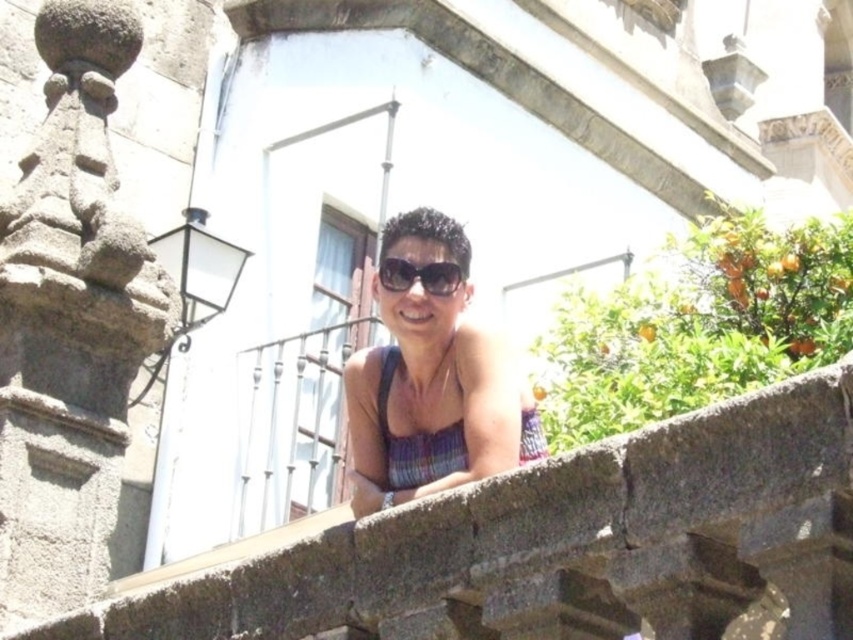
Is rough stone ledge at center thinner than green leafy bush at upper right?

No, rough stone ledge at center is not thinner than green leafy bush at upper right.

Which is above, rough stone ledge at center or green leafy bush at upper right?

green leafy bush at upper right is higher up.

Between point (642, 604) and point (693, 260), which one is positioned behind?

Positioned behind is point (693, 260).

What are the coordinates of `rough stone ledge at center` in the screenshot? It's located at (563, 544).

Does rough stone ledge at center lie in front of matte black tank top at center?

Yes, it is in front of matte black tank top at center.

Is rough stone ledge at center positioned at the back of matte black tank top at center?

No, rough stone ledge at center is in front of matte black tank top at center.

Which is behind, point (648, 502) or point (498, 340)?

Positioned behind is point (498, 340).

At what (x,y) coordinates should I click in order to perform the action: click on rough stone ledge at center. Please return your answer as a coordinate pair (x, y). Looking at the image, I should click on (563, 544).

Based on the photo, between rough stone ledge at center and black plastic sunglasses at center, which one is positioned higher?

black plastic sunglasses at center is higher up.

Which is more to the left, rough stone ledge at center or black plastic sunglasses at center?

rough stone ledge at center

Is point (555, 566) farther from camera compared to point (431, 282)?

No, it is in front of (431, 282).

You are a GUI agent. You are given a task and a screenshot of the screen. Output one action in this format:
    pyautogui.click(x=<x>, y=<y>)
    Task: Click on the rough stone ledge at center
    The height and width of the screenshot is (640, 853).
    Given the screenshot: What is the action you would take?
    pyautogui.click(x=563, y=544)